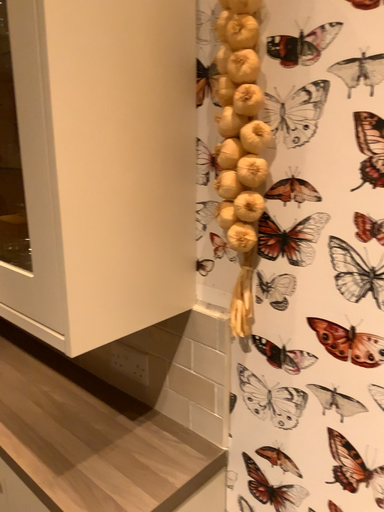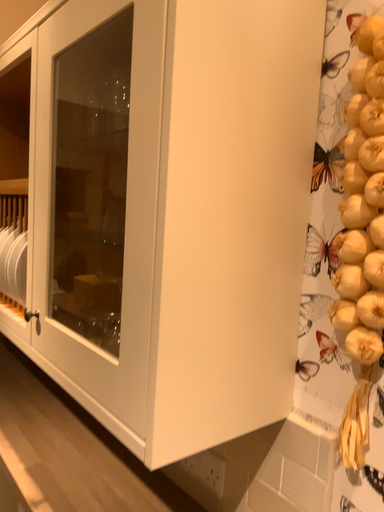
Question: How did the camera likely rotate when shooting the video?

Choices:
 (A) rotated right
 (B) rotated left

Answer: (B)